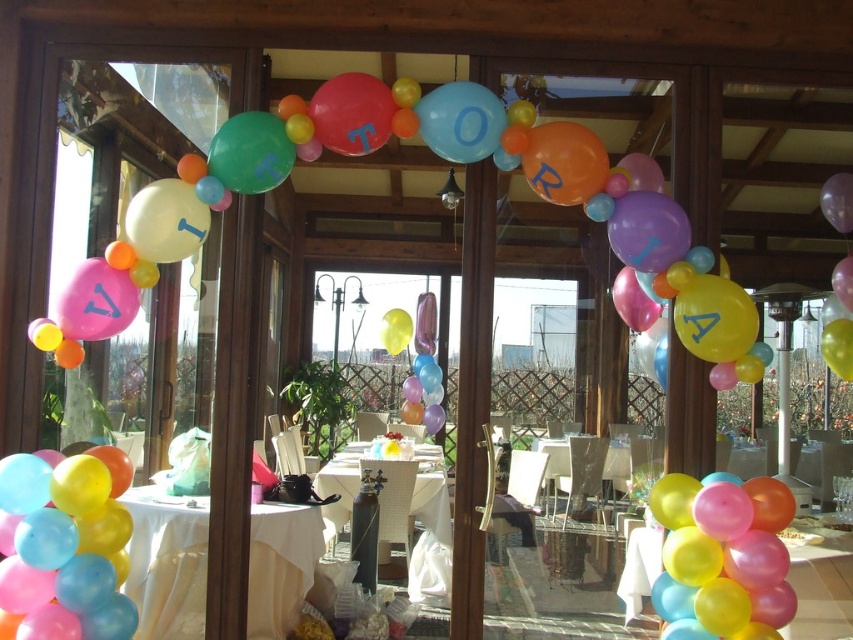
You are planning to set up a photo booth in the center of the room. The photo booth requires a space of 2 meters between the white cloth table at center and the metallic silver table at center. Can the existing tables accommodate this setup?

The white cloth table at center is 1.86 meters away from the metallic silver table at center. Since the required distance is 2 meters, the existing tables are too close to accommodate the photo booth setup.